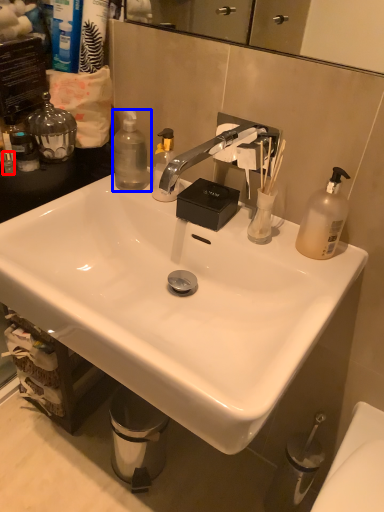
Question: Which of the following is the closest to the observer, toiletry (highlighted by a red box) or bottle (highlighted by a blue box)?

Choices:
 (A) toiletry
 (B) bottle

Answer: (A)